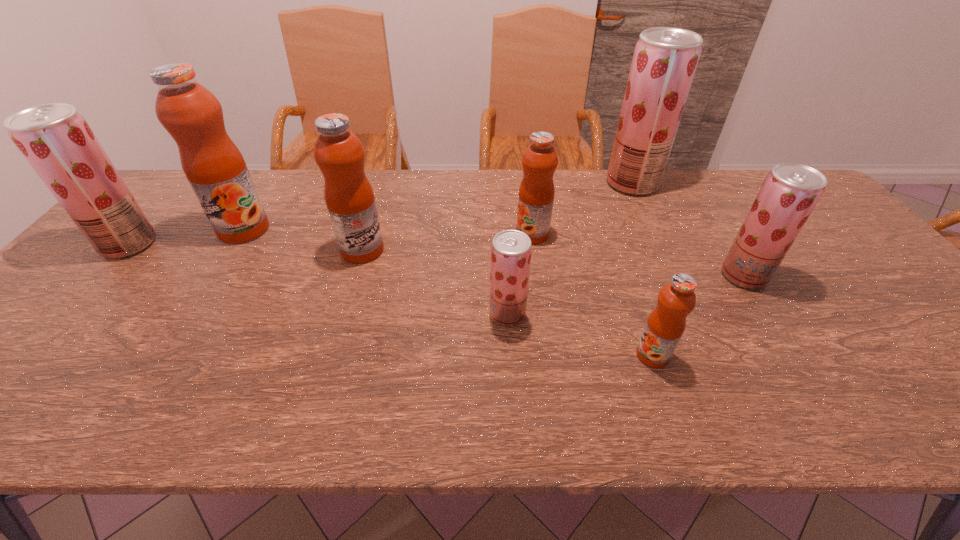
At what (x,y) coordinates should I click in order to perform the action: click on the second smallest orange fruit juice. Please return your answer as a coordinate pair (x, y). The image size is (960, 540). Looking at the image, I should click on pos(536,194).

Identify the location of the nearest strawberry fruit juice. The width and height of the screenshot is (960, 540). (511, 250).

I want to click on the second strawberry fruit juice from left to right, so click(x=511, y=250).

What are the coordinates of `the smallest orange fruit juice` in the screenshot? It's located at (665, 326).

What are the coordinates of `the nearest orange fruit juice` in the screenshot? It's located at (665, 326).

The image size is (960, 540). In order to click on free space located on the front of the farthest fruit juice in this screenshot , I will do `click(676, 279)`.

Locate an element on the screen. blank area located on the front label of the biggest orange fruit juice is located at coordinates (186, 322).

The image size is (960, 540). Identify the location of blank space located on the front of the leftmost object. (95, 282).

At what (x,y) coordinates should I click in order to perform the action: click on vacant space located 0.220m on the front label of the third orange fruit juice from right to left. Please return your answer as a coordinate pair (x, y). Looking at the image, I should click on (464, 250).

Where is `free point located 0.270m on the left of the rightmost fruit juice`? free point located 0.270m on the left of the rightmost fruit juice is located at coordinates (617, 275).